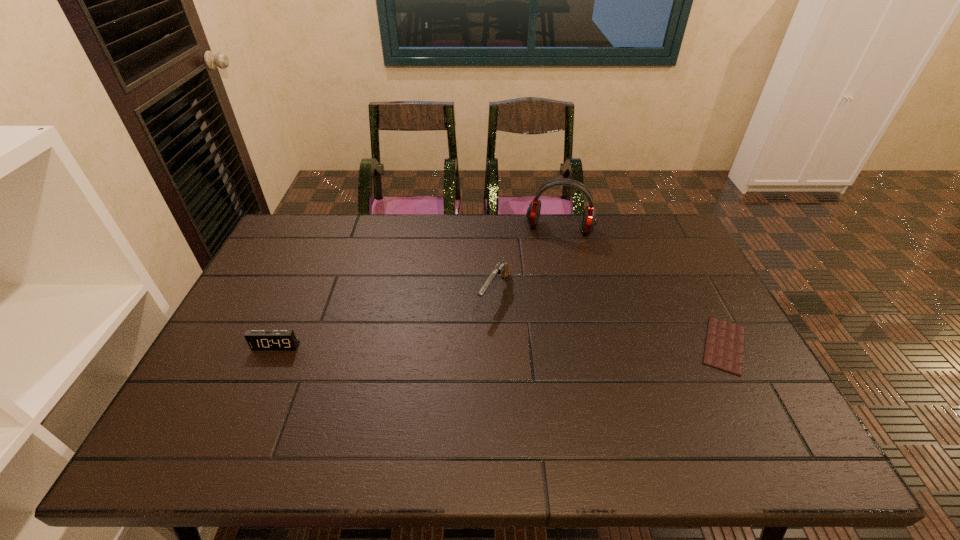
At what (x,y) coordinates should I click in order to perform the action: click on alarm clock. Please return your answer as a coordinate pair (x, y). The height and width of the screenshot is (540, 960). Looking at the image, I should click on (257, 339).

Identify the location of the second shortest object. (257, 339).

I want to click on the shortest object, so click(724, 344).

The image size is (960, 540). Identify the location of the rightmost object. (724, 344).

Identify the location of gun. This screenshot has width=960, height=540. (501, 268).

The image size is (960, 540). I want to click on the second tallest object, so click(501, 268).

You are a GUI agent. You are given a task and a screenshot of the screen. Output one action in this format:
    pyautogui.click(x=<x>, y=<y>)
    Task: Click on the second object from right to left
    
    Given the screenshot: What is the action you would take?
    pyautogui.click(x=589, y=221)

At what (x,y) coordinates should I click in order to perform the action: click on the tallest object. Please return your answer as a coordinate pair (x, y). The height and width of the screenshot is (540, 960). Looking at the image, I should click on (589, 221).

In order to click on vacant point located 0.180m on the front-facing side of the leftmost object in this screenshot , I will do `click(247, 412)`.

The height and width of the screenshot is (540, 960). In order to click on free space located on the left of the shortest object in this screenshot , I will do `click(578, 345)`.